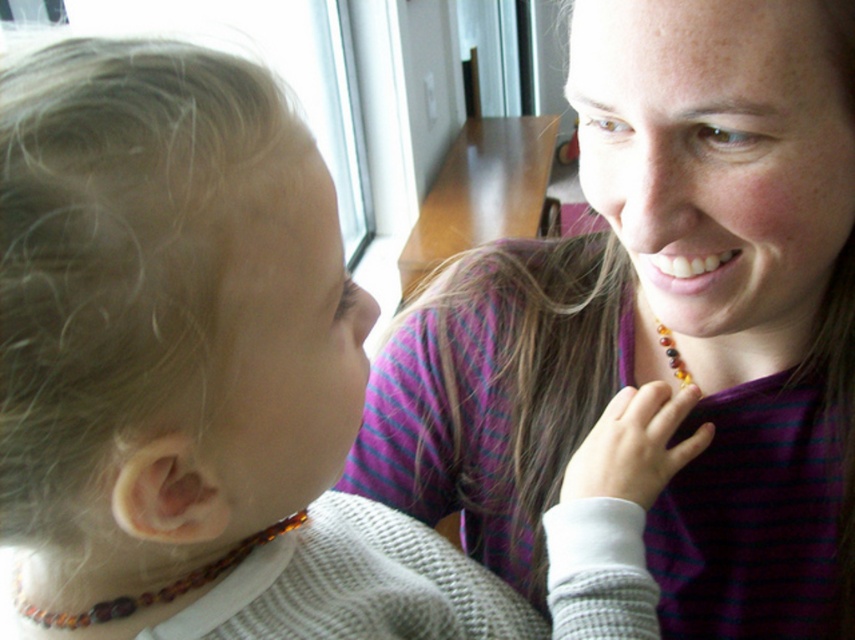
Who is more distant from viewer, (484,484) or (133,332)?

Point (484,484)

Does matte amber necklace at center have a lesser height compared to amber beaded necklace at left?

Incorrect, matte amber necklace at center's height does not fall short of amber beaded necklace at left's.

Between point (491, 317) and point (42, 282), which one is positioned behind?

The point (491, 317) is behind.

At what (x,y) coordinates should I click in order to perform the action: click on matte amber necklace at center. Please return your answer as a coordinate pair (x, y). Looking at the image, I should click on (665, 321).

From the picture: Does cognac amber beads at left come behind amber beaded necklace at center?

No, it is in front of amber beaded necklace at center.

Between point (251, 536) and point (681, 387), which one is positioned in front?

Positioned in front is point (251, 536).

Is point (13, 582) closer to camera compared to point (676, 380)?

Yes, point (13, 582) is in front of point (676, 380).

Locate an element on the screen. cognac amber beads at left is located at coordinates (155, 589).

Between matte amber necklace at center and amber beaded necklace at center, which one has more height?

matte amber necklace at center

Can you confirm if matte amber necklace at center is bigger than amber beaded necklace at center?

Indeed, matte amber necklace at center has a larger size compared to amber beaded necklace at center.

In order to click on matte amber necklace at center in this screenshot , I will do `click(665, 321)`.

This screenshot has width=855, height=640. What are the coordinates of `matte amber necklace at center` in the screenshot? It's located at (665, 321).